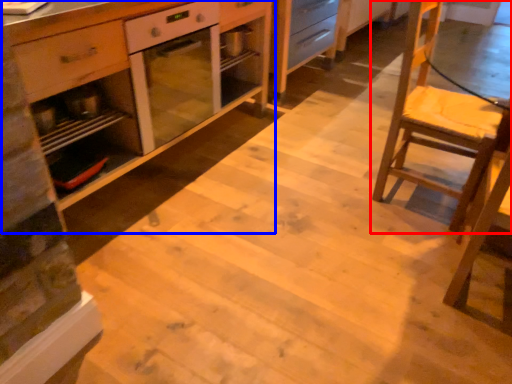
Question: Which object is closer to the camera taking this photo, chair (highlighted by a red box) or cabinetry (highlighted by a blue box)?

Choices:
 (A) chair
 (B) cabinetry

Answer: (B)